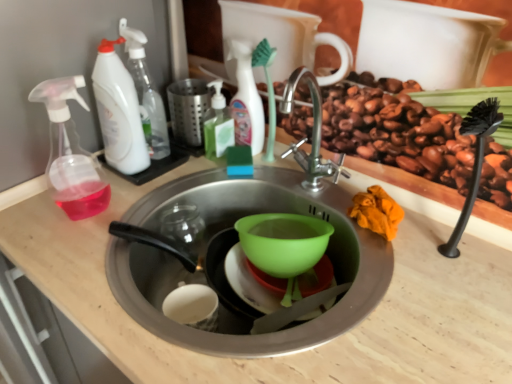
Where is `vacant area that lies between transparent plastic spray bottle at left and white matte bottle at upper center, the first cleaning product from the right`? Image resolution: width=512 pixels, height=384 pixels. vacant area that lies between transparent plastic spray bottle at left and white matte bottle at upper center, the first cleaning product from the right is located at coordinates (166, 181).